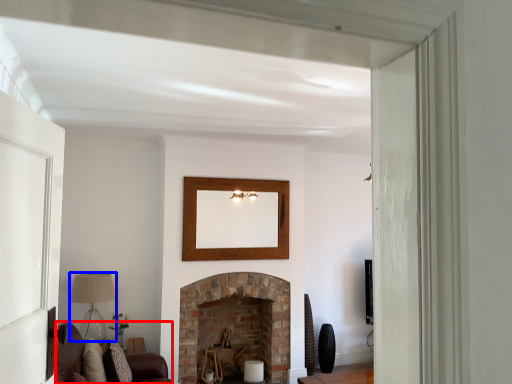
Question: Which of the following is the closest to the observer, couch (highlighted by a red box) or lamp (highlighted by a blue box)?

Choices:
 (A) couch
 (B) lamp

Answer: (A)